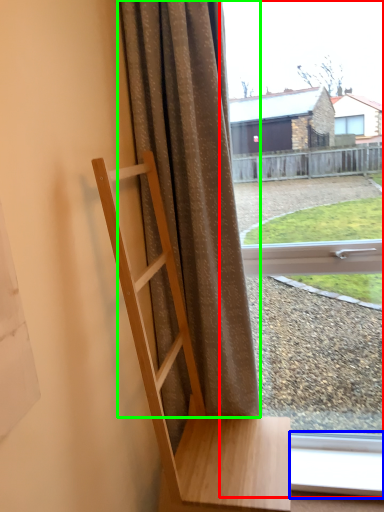
Question: Which object is positioned farthest from window (highlighted by a red box)? Select from window frame (highlighted by a blue box) and curtain (highlighted by a green box).

Choices:
 (A) window frame
 (B) curtain

Answer: (A)